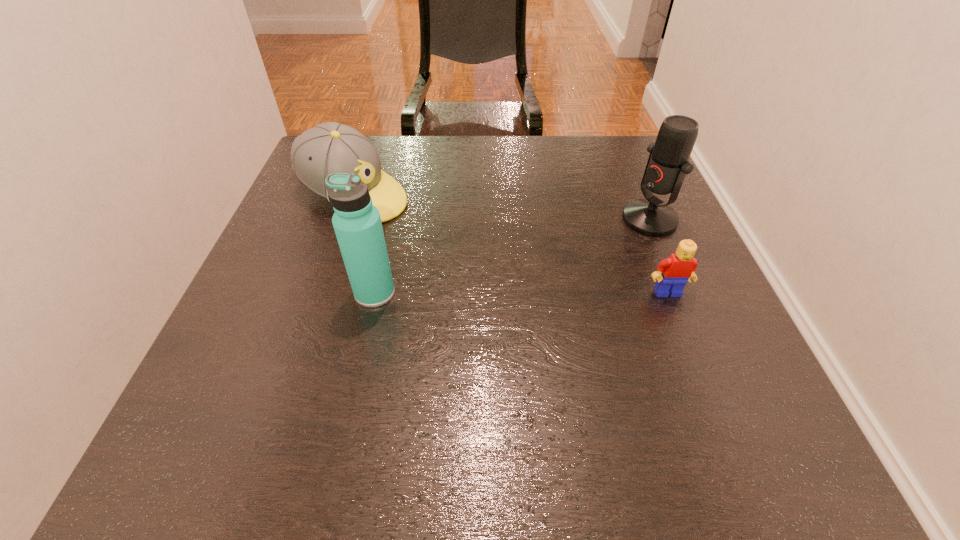
The width and height of the screenshot is (960, 540). What are the coordinates of `free spot on the desktop that is between the thermos bottle and the Lego and is positioned on the front-facing side of the baseball cap` in the screenshot? It's located at (554, 293).

The height and width of the screenshot is (540, 960). Identify the location of free space on the desktop that is between the thermos bottle and the Lego and is positioned on the side of the microphone with the red ring. (489, 293).